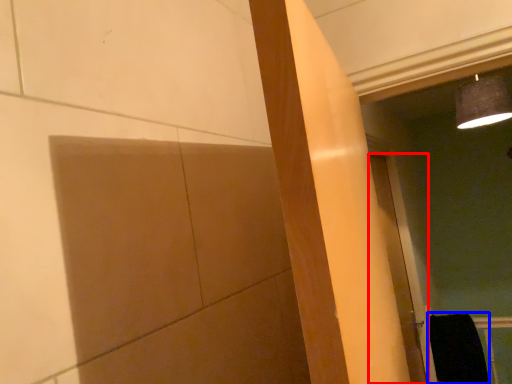
Question: Which of the following is the farthest to the observer, door (highlighted by a red box) or material (highlighted by a blue box)?

Choices:
 (A) door
 (B) material

Answer: (B)